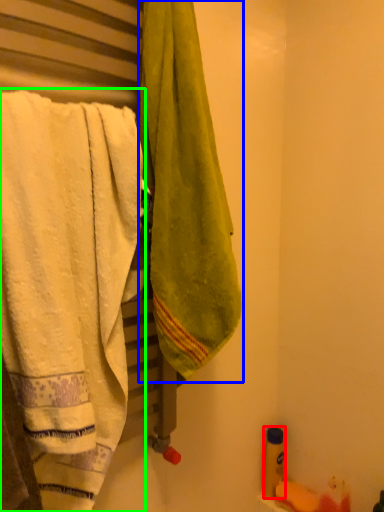
Question: Considering the real-world distances, which object is farthest from toiletry (highlighted by a red box)? towel (highlighted by a blue box) or towel (highlighted by a green box)?

Choices:
 (A) towel
 (B) towel

Answer: (B)